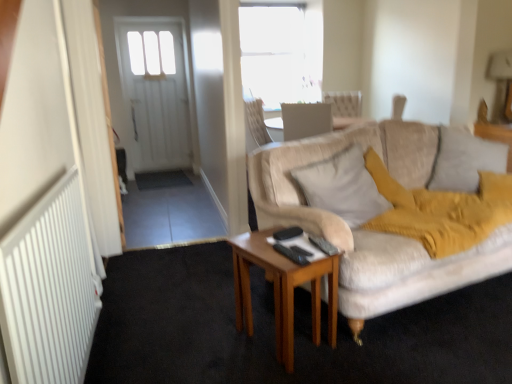
Find the location of a particular element. free point above wooden table at center (from a real-world perspective) is located at coordinates (285, 244).